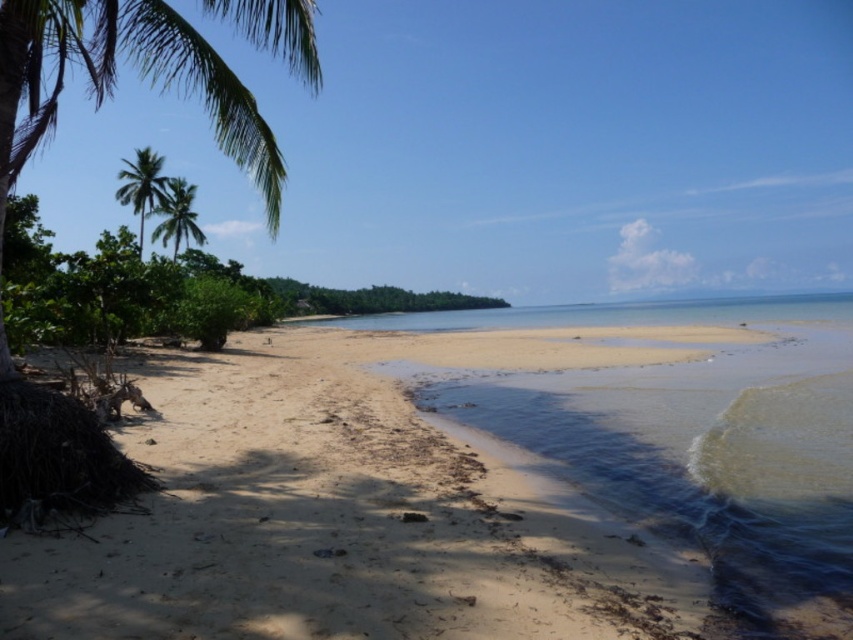
Question: Is green leafy palm tree at upper left wider than green leafy palm tree at left?

Choices:
 (A) no
 (B) yes

Answer: (B)

Question: Does sandy beach at lower left lie behind green leafy palm tree at upper left?

Choices:
 (A) no
 (B) yes

Answer: (A)

Question: Among these points, which one is farthest from the camera?

Choices:
 (A) (141, 252)
 (B) (309, 545)

Answer: (A)

Question: Which point appears closest to the camera in this image?

Choices:
 (A) (184, 227)
 (B) (126, 193)
 (C) (521, 451)

Answer: (C)

Question: Which point is farther to the camera?

Choices:
 (A) green leafy palm tree at upper left
 (B) green leafy palm tree at left
 (C) sandy beach at lower left

Answer: (B)

Question: Considering the relative positions of sandy beach at lower left and green leafy palm tree at upper left in the image provided, where is sandy beach at lower left located with respect to green leafy palm tree at upper left?

Choices:
 (A) above
 (B) below

Answer: (B)